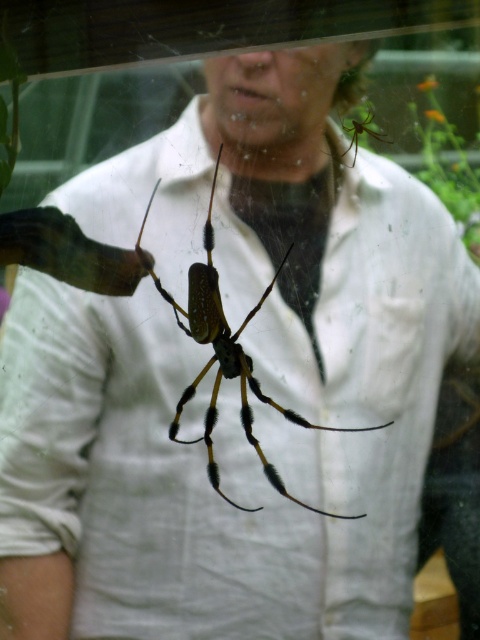
Looking at this image, does shiny metallic spider at center lie behind shiny green spider at upper right?

Yes, shiny metallic spider at center is further from the viewer.

Does shiny metallic spider at center have a lesser height compared to shiny green spider at upper right?

No.

Where is `shiny metallic spider at center`? This screenshot has width=480, height=640. shiny metallic spider at center is located at coordinates (225, 355).

What are the coordinates of `shiny metallic spider at center` in the screenshot? It's located at (225, 355).